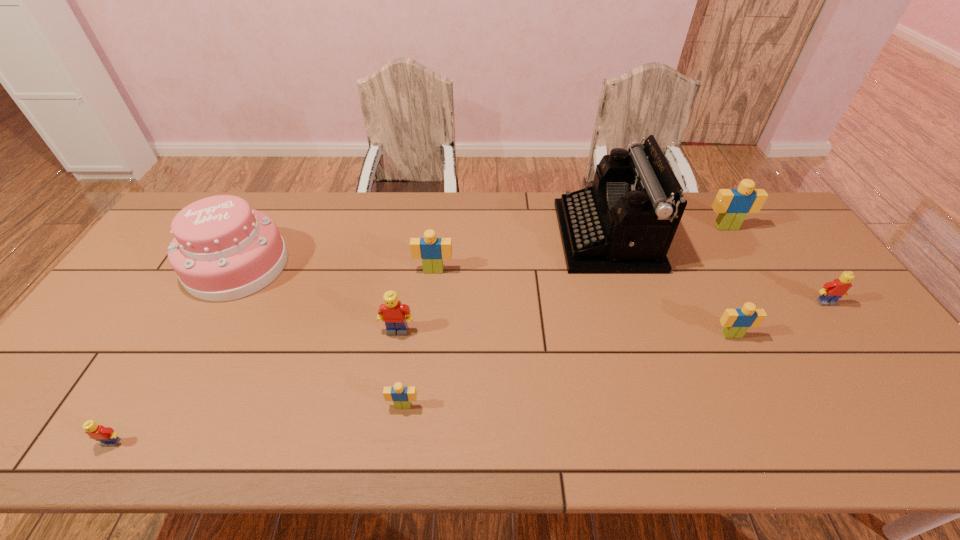
You are a GUI agent. You are given a task and a screenshot of the screen. Output one action in this format:
    pyautogui.click(x=<x>, y=<y>)
    Task: Click on the third object from right to left
    The image size is (960, 540).
    Given the screenshot: What is the action you would take?
    pyautogui.click(x=736, y=322)

Locate an element on the screen. the rightmost object is located at coordinates (832, 291).

Find the location of a particular element. the rightmost yellow Lego is located at coordinates (832, 291).

This screenshot has width=960, height=540. Identify the location of the eighth farthest object. (401, 396).

Where is `the smallest beige Lego`? This screenshot has width=960, height=540. the smallest beige Lego is located at coordinates (401, 396).

Identify the location of the nearest object. The height and width of the screenshot is (540, 960). (106, 435).

Where is `the nearest yellow Lego`? the nearest yellow Lego is located at coordinates (106, 435).

Where is `vacant point located on the typing side of the tallest object`? vacant point located on the typing side of the tallest object is located at coordinates (481, 236).

Locate an element on the screen. This screenshot has width=960, height=540. free space located 0.180m on the typing side of the tallest object is located at coordinates (505, 236).

Where is `vacant space located 0.400m on the typing side of the tallest object`? This screenshot has width=960, height=540. vacant space located 0.400m on the typing side of the tallest object is located at coordinates (438, 236).